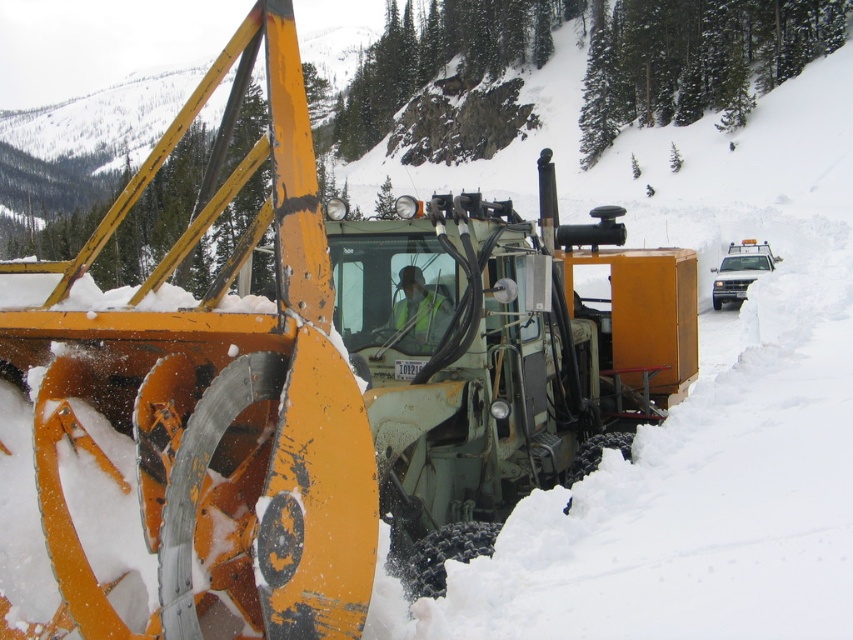
You are a safety inspector checking the equipment setup of the snowplow operation. Based on the image, is the reflective yellow safety vest at center placed correctly in relation to the matte yellow snowplow at center according to standard safety protocols that require safety vests to be placed on the right side of the machinery for visibility?

The reflective yellow safety vest at center is positioned on the left side of the matte yellow snowplow at center, which contradicts the standard safety protocols requiring it to be on the right side for visibility.

You are a safety inspector checking the visibility of safety gear in the snowplow scene. According to the image, which object is wider, the reflective yellow safety vest at center or the matte yellow snowplow at center?

The reflective yellow safety vest at center is wider than the matte yellow snowplow at center.